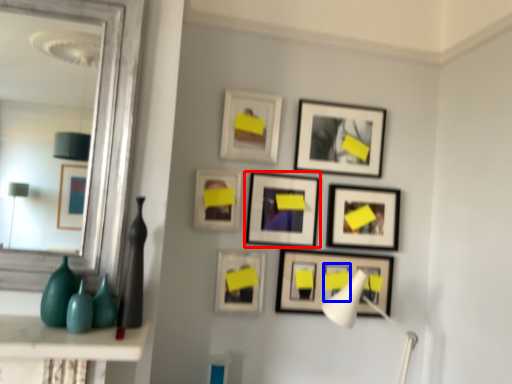
Question: Among these objects, which one is farthest to the camera, picture frame (highlighted by a red box) or picture frame (highlighted by a blue box)?

Choices:
 (A) picture frame
 (B) picture frame

Answer: (B)